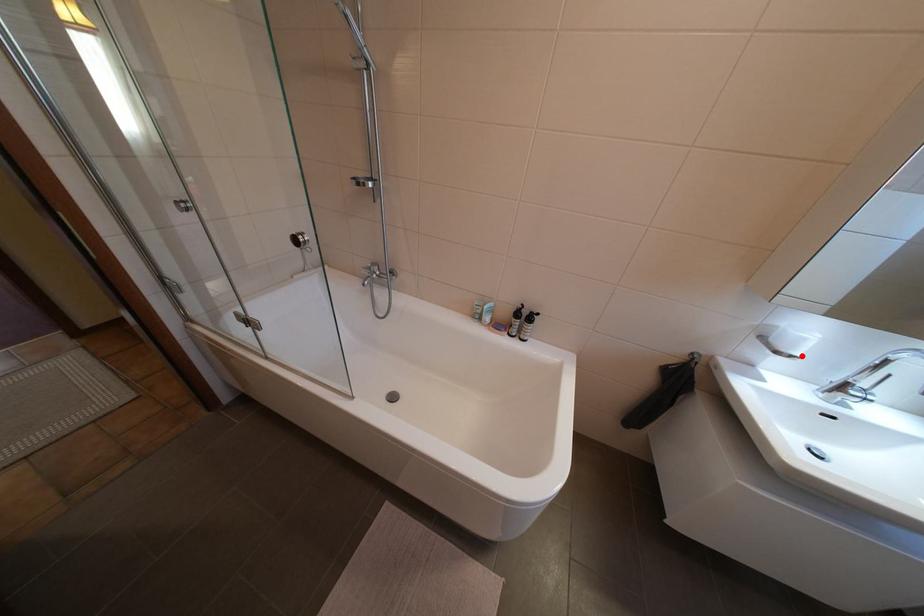
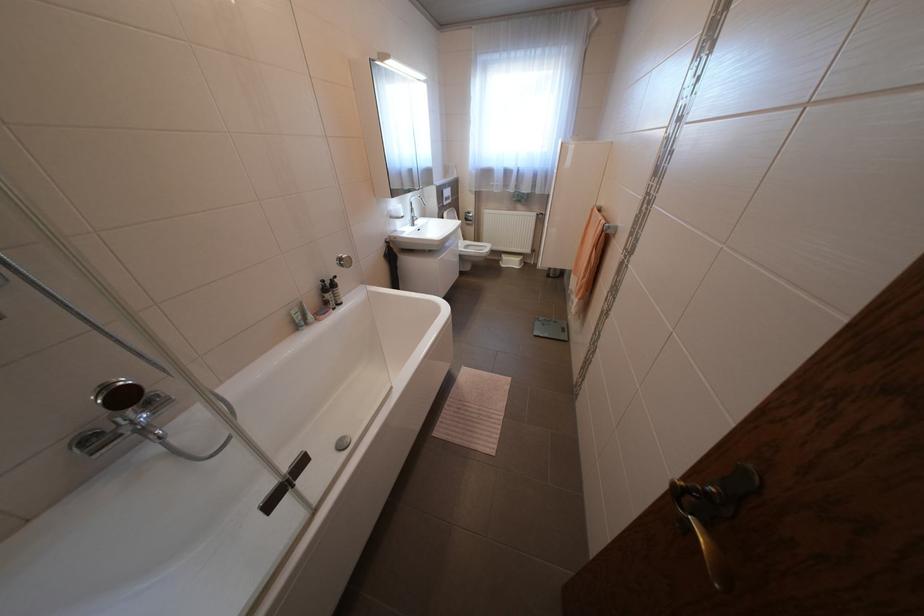
Question: I am providing you with two images of the same scene from different viewpoints. A red point is shown in image1. For the corresponding object point in image2, is it positioned nearer or farther from the camera?

Choices:
 (A) Nearer
 (B) Farther

Answer: (A)